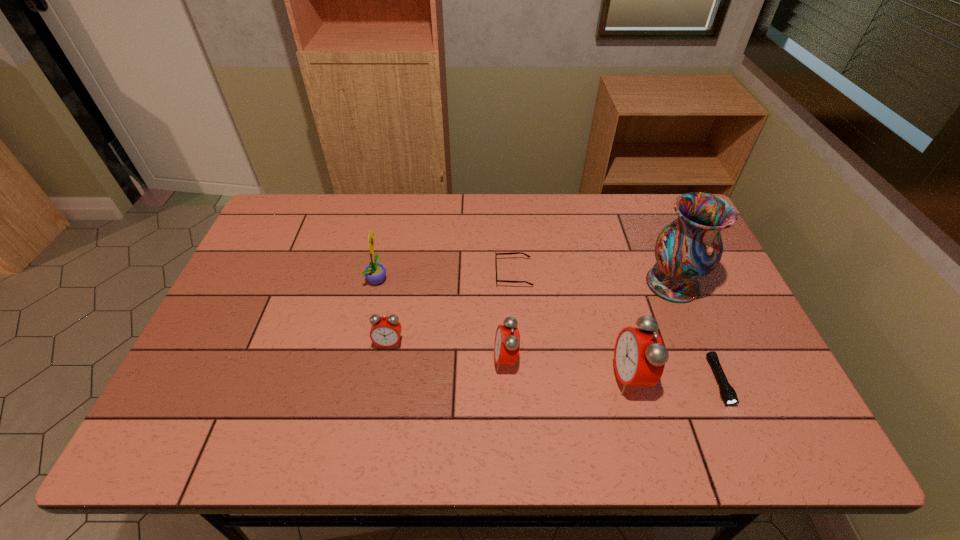
Find the location of a particular element. free space that is in between the second alarm clock from left to right and the sunglasses is located at coordinates (510, 316).

Image resolution: width=960 pixels, height=540 pixels. In order to click on object that stands as the sixth closest to the sunflower in this screenshot , I will do `click(728, 393)`.

Identify which object is the sixth closest to the second tallest alarm clock. Please provide its 2D coordinates. Your answer should be formatted as a tuple, i.e. [(x, y)], where the tuple contains the x and y coordinates of a point satisfying the conditions above.

[(728, 393)]

This screenshot has height=540, width=960. What are the coordinates of `alarm clock that can be found as the closest to the leftmost alarm clock` in the screenshot? It's located at (507, 339).

Find the location of a particular element. The height and width of the screenshot is (540, 960). alarm clock object that ranks as the closest to the flashlight is located at coordinates (639, 359).

Find the location of `vacant space that satisfies the following two spatial constraints: 1. on the front side of the tallest object; 2. on the front-facing side of the fourth tallest object`. vacant space that satisfies the following two spatial constraints: 1. on the front side of the tallest object; 2. on the front-facing side of the fourth tallest object is located at coordinates (704, 360).

What are the coordinates of `blank area in the image that satisfies the following two spatial constraints: 1. on the front-facing side of the sunglasses; 2. on the left side of the tallest object` in the screenshot? It's located at (515, 284).